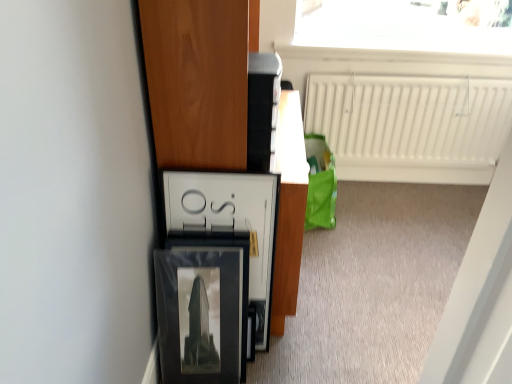
Question: From a real-world perspective, is matte black picture frame at lower left above or below white matte radiator at upper right?

Choices:
 (A) below
 (B) above

Answer: (A)

Question: Would you say matte black picture frame at lower left is inside or outside white matte radiator at upper right?

Choices:
 (A) inside
 (B) outside

Answer: (B)

Question: Estimate the real-world distances between objects in this image. Which object is farther from the white matte radiator at upper right?

Choices:
 (A) matte black picture frame at lower left
 (B) white glossy frame at center
 (C) wooden cabinet at left

Answer: (A)

Question: Estimate the real-world distances between objects in this image. Which object is closer to the matte black picture frame at lower left?

Choices:
 (A) white matte radiator at upper right
 (B) wooden cabinet at left
 (C) white glossy frame at center

Answer: (C)